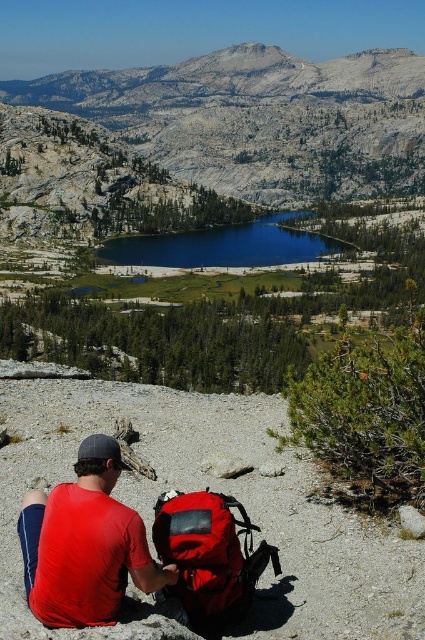
Question: Which point is closer to the camera?

Choices:
 (A) (42, 532)
 (B) (215, 616)
 (C) (240, 92)
 (D) (200, 257)

Answer: (A)

Question: Is gray rocky mountain at upper center wider than blue reflective water at center?

Choices:
 (A) yes
 (B) no

Answer: (A)

Question: Which of the following is the farthest from the observer?

Choices:
 (A) matte red backpack at lower center
 (B) blue reflective water at center

Answer: (B)

Question: Which point is farther from the camera taking this photo?

Choices:
 (A) (90, 579)
 (B) (359, 113)
 (C) (107, 241)

Answer: (B)

Question: Can you confirm if red matte shirt at lower left is bigger than blue reflective water at center?

Choices:
 (A) yes
 (B) no

Answer: (B)

Question: Does gray rocky mountain at upper center appear under red matte shirt at lower left?

Choices:
 (A) yes
 (B) no

Answer: (B)